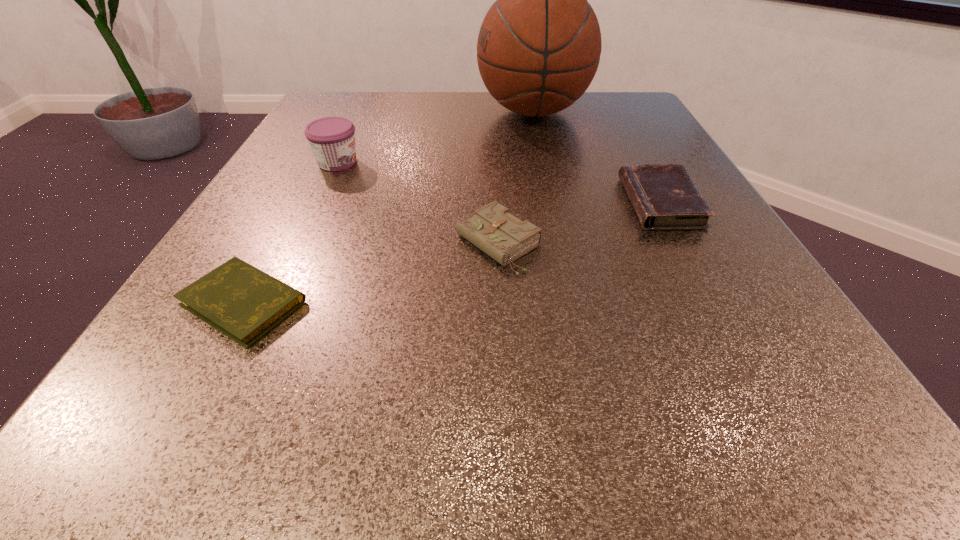
Where is `vacant space situated 0.200m on the side with brand label of the basketball`? vacant space situated 0.200m on the side with brand label of the basketball is located at coordinates (390, 112).

The image size is (960, 540). In order to click on free point located on the front label of the fourth shortest object in this screenshot , I will do `click(523, 163)`.

Where is `vacant region located 0.250m on the right of the second diary from left to right`? The image size is (960, 540). vacant region located 0.250m on the right of the second diary from left to right is located at coordinates (708, 244).

Locate an element on the screen. This screenshot has width=960, height=540. vacant region located on the front of the rightmost diary is located at coordinates (793, 448).

Identify the location of free region located on the back of the shortest diary. The height and width of the screenshot is (540, 960). (323, 156).

This screenshot has width=960, height=540. Find the location of `object that is positioned at the far edge`. object that is positioned at the far edge is located at coordinates (539, 45).

You are a GUI agent. You are given a task and a screenshot of the screen. Output one action in this format:
    pyautogui.click(x=<x>, y=<y>)
    Task: Click on the jam present at the left edge
    This screenshot has height=540, width=960.
    Given the screenshot: What is the action you would take?
    pyautogui.click(x=332, y=139)

What are the coordinates of `diary at the left edge` in the screenshot? It's located at (242, 302).

You are a GUI agent. You are given a task and a screenshot of the screen. Output one action in this format:
    pyautogui.click(x=<x>, y=<y>)
    Task: Click on the basketball present at the right edge
    The height and width of the screenshot is (540, 960).
    Given the screenshot: What is the action you would take?
    pyautogui.click(x=539, y=45)

The image size is (960, 540). Identify the location of diary situated at the right edge. (664, 196).